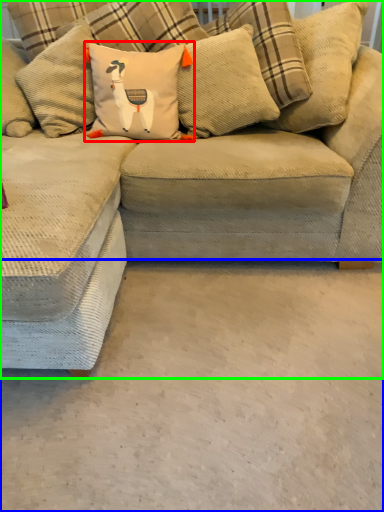
Question: Which is nearer to the pillow (highlighted by a red box)? concrete (highlighted by a blue box) or studio couch (highlighted by a green box).

Choices:
 (A) concrete
 (B) studio couch

Answer: (B)